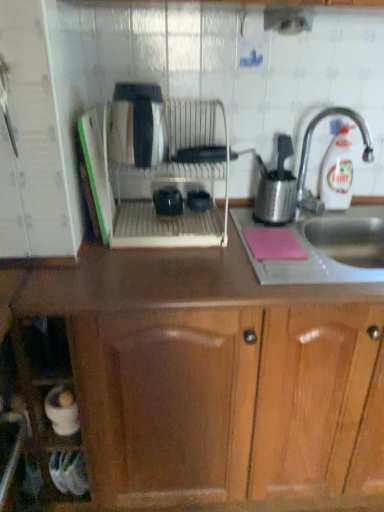
Question: Considering the relative sizes of black plastic bowls at center, which is the 2th appliance in left-to-right order, and white plastic bottle at upper right in the image provided, is black plastic bowls at center, which is the 2th appliance in left-to-right order, thinner than white plastic bottle at upper right?

Choices:
 (A) no
 (B) yes

Answer: (A)

Question: From the image's perspective, does black plastic bowls at center, which is the 2th appliance in left-to-right order, appear lower than white plastic bottle at upper right?

Choices:
 (A) yes
 (B) no

Answer: (A)

Question: Is black plastic bowls at center, which is the 2th appliance in left-to-right order, at the right side of white plastic bottle at upper right?

Choices:
 (A) no
 (B) yes

Answer: (A)

Question: Is black plastic bowls at center, which is the 2th appliance in left-to-right order, bigger than white plastic bottle at upper right?

Choices:
 (A) yes
 (B) no

Answer: (B)

Question: Is point (269, 202) closer or farther from the camera than point (292, 237)?

Choices:
 (A) farther
 (B) closer

Answer: (A)

Question: Looking at their shapes, would you say stainless steel utensil holder at right is wider or thinner than pink matte notepad at lower right?

Choices:
 (A) wide
 (B) thin

Answer: (A)

Question: Would you say stainless steel utensil holder at right is inside or outside pink matte notepad at lower right?

Choices:
 (A) outside
 (B) inside

Answer: (A)

Question: Visually, is stainless steel utensil holder at right positioned to the left or to the right of pink matte notepad at lower right?

Choices:
 (A) right
 (B) left

Answer: (A)

Question: From the image's perspective, is wooden cabinet at center located above or below satin silver dish rack at center?

Choices:
 (A) below
 (B) above

Answer: (A)

Question: Is wooden cabinet at center to the left or to the right of satin silver dish rack at center in the image?

Choices:
 (A) right
 (B) left

Answer: (A)

Question: Considering their positions, is wooden cabinet at center located in front of or behind satin silver dish rack at center?

Choices:
 (A) front
 (B) behind

Answer: (A)

Question: Choose the correct answer: Is wooden cabinet at center inside satin silver dish rack at center or outside it?

Choices:
 (A) inside
 (B) outside

Answer: (B)

Question: Would you say wooden cabinet at center is inside or outside metallic sink at right?

Choices:
 (A) outside
 (B) inside

Answer: (A)

Question: In terms of height, does wooden cabinet at center look taller or shorter compared to metallic sink at right?

Choices:
 (A) short
 (B) tall

Answer: (B)